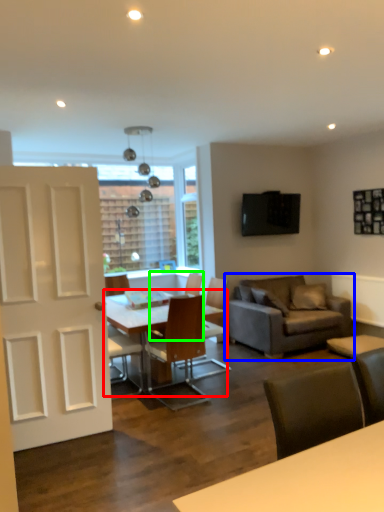
Question: Considering the real-world distances, which object is farthest from table (highlighted by a red box)? studio couch (highlighted by a blue box) or chair (highlighted by a green box)?

Choices:
 (A) studio couch
 (B) chair

Answer: (A)